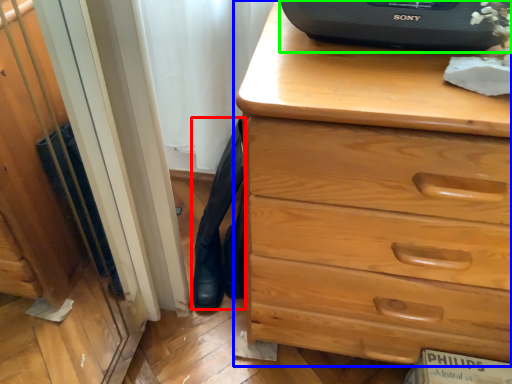
Question: Which object is positioned closest to tight (highlighted by a red box)? Select from chest of drawers (highlighted by a blue box) and desktop computer (highlighted by a green box).

Choices:
 (A) chest of drawers
 (B) desktop computer

Answer: (A)